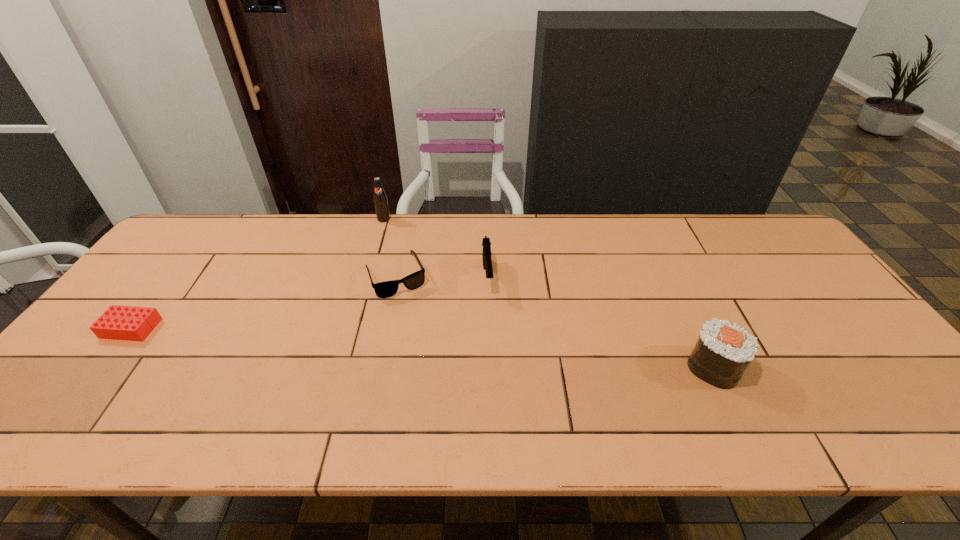
Image resolution: width=960 pixels, height=540 pixels. I want to click on pop that is positioned at the far edge, so click(x=380, y=199).

I want to click on pistol positioned at the far edge, so click(486, 254).

Where is `object located in the near edge section of the desktop`? The height and width of the screenshot is (540, 960). object located in the near edge section of the desktop is located at coordinates (723, 351).

You are a GUI agent. You are given a task and a screenshot of the screen. Output one action in this format:
    pyautogui.click(x=<x>, y=<y>)
    Task: Click on the object present at the left edge
    
    Given the screenshot: What is the action you would take?
    pyautogui.click(x=130, y=323)

Find the location of a particular element. The width and height of the screenshot is (960, 540). vacant space at the far edge of the desktop is located at coordinates tap(493, 217).

You are a GUI agent. You are given a task and a screenshot of the screen. Output one action in this format:
    pyautogui.click(x=<x>, y=<y>)
    Task: Click on the vacant space at the near edge of the desktop
    The height and width of the screenshot is (540, 960).
    Given the screenshot: What is the action you would take?
    pyautogui.click(x=208, y=396)

In the image, there is a desktop. Where is `vacant space at the left edge`? vacant space at the left edge is located at coordinates (179, 291).

In the image, there is a desktop. Identify the location of free region at the right edge. (776, 262).

Image resolution: width=960 pixels, height=540 pixels. What are the coordinates of `vacant space at the far left corner of the desktop` in the screenshot? It's located at (198, 218).

The image size is (960, 540). Identify the location of vacant space at the near left corner of the desktop. (102, 393).